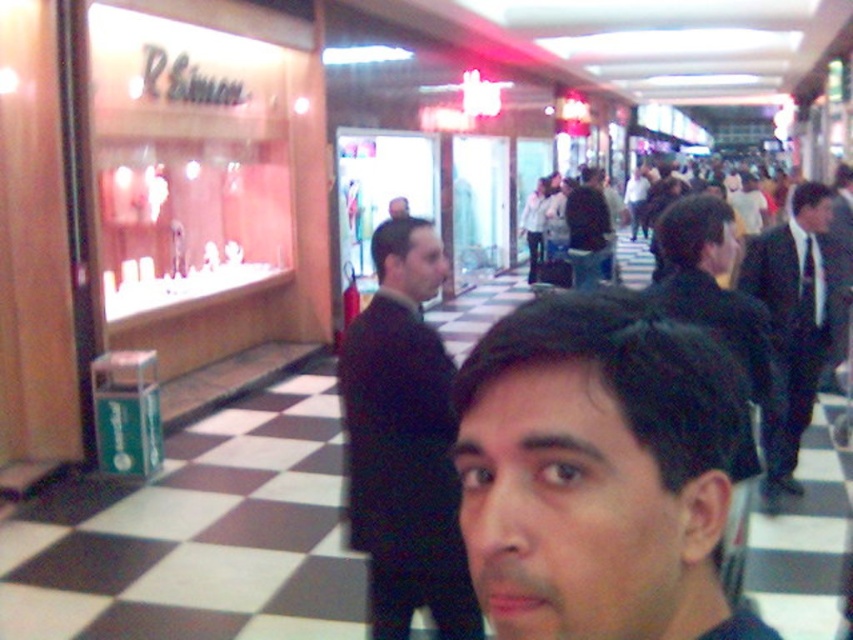
You are a photographer who needs to capture a clear shot of the dark hair at center and the black suit at right. Based on their positions, which object is higher in the image?

The dark hair at center is located above the black suit at right, so the dark hair at center is higher in the image.

Based on the scene description, where is the dark hair at center located in terms of coordinates?

The dark hair at center is located at point coordinates of (x=598, y=472).